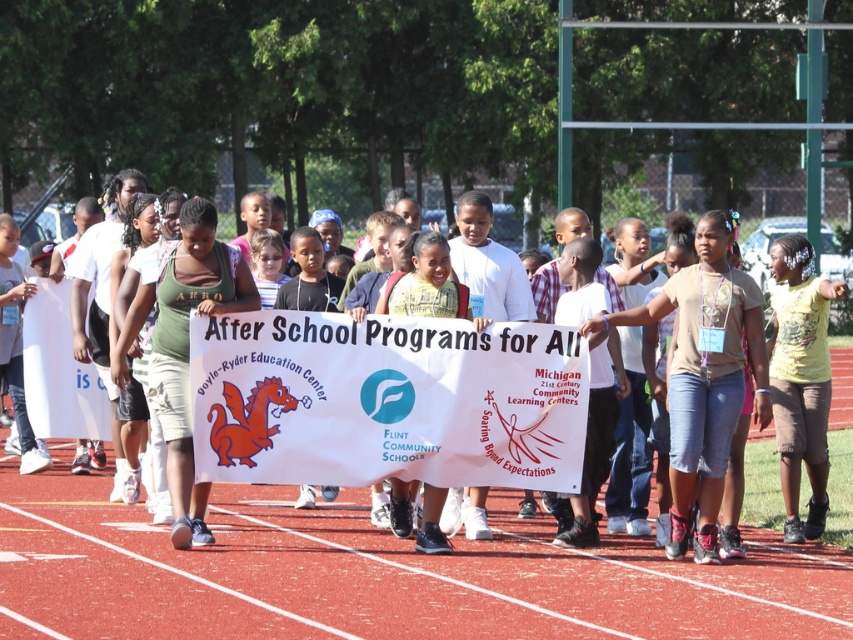
You are a photographer standing at the edge of the field. You need to capture a photo that includes both the red rubber track at center and the white paper sign at center. Based on their positions, which object should appear higher in the photo?

The white paper sign at center should appear higher in the photo because the red rubber track at center is located below it.

You are a photographer standing at the edge of the field. You need to position yourself so that both the red rubber track at center and the white paper sign at center are visible in your shot. Which object should you place closer to the left side of your camera frame?

The red rubber track at center is to the left of the white paper sign at center, so you should place the red rubber track at center closer to the left side of your camera frame.